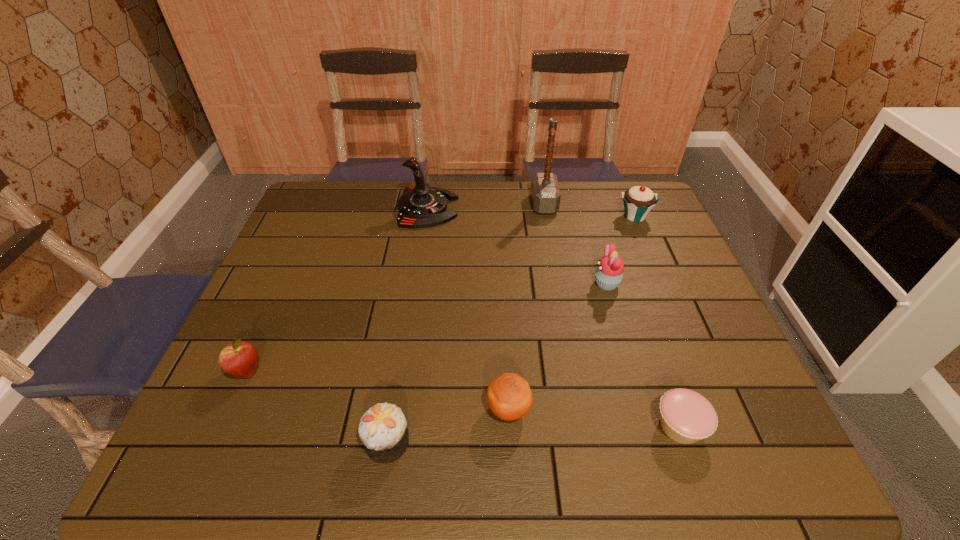
The width and height of the screenshot is (960, 540). In the image, there is a desktop. What are the coordinates of `free region at the left edge` in the screenshot? It's located at (290, 372).

In the image, there is a desktop. Find the location of `free region at the right edge`. free region at the right edge is located at coordinates (727, 371).

The image size is (960, 540). In order to click on free space at the far left corner of the desktop in this screenshot , I will do `click(306, 204)`.

In the image, there is a desktop. Where is `vacant space at the near right corner`? vacant space at the near right corner is located at coordinates (701, 448).

Find the location of a particular element. The width and height of the screenshot is (960, 540). empty space between the third tallest cupcake and the fourth nearest object is located at coordinates (317, 407).

Where is `free space between the joystick and the farthest cupcake`? This screenshot has width=960, height=540. free space between the joystick and the farthest cupcake is located at coordinates (531, 212).

Where is `vacant space in between the orange and the shortest cupcake`? vacant space in between the orange and the shortest cupcake is located at coordinates (594, 417).

This screenshot has height=540, width=960. I want to click on free space between the hammer and the fourth object from left to right, so coord(526,306).

Find the location of a particular element. The width and height of the screenshot is (960, 540). free space between the second farthest cupcake and the fifth farthest object is located at coordinates (x=426, y=328).

What are the coordinates of `free space between the seventh shortest object and the fourth farthest object` in the screenshot? It's located at (516, 246).